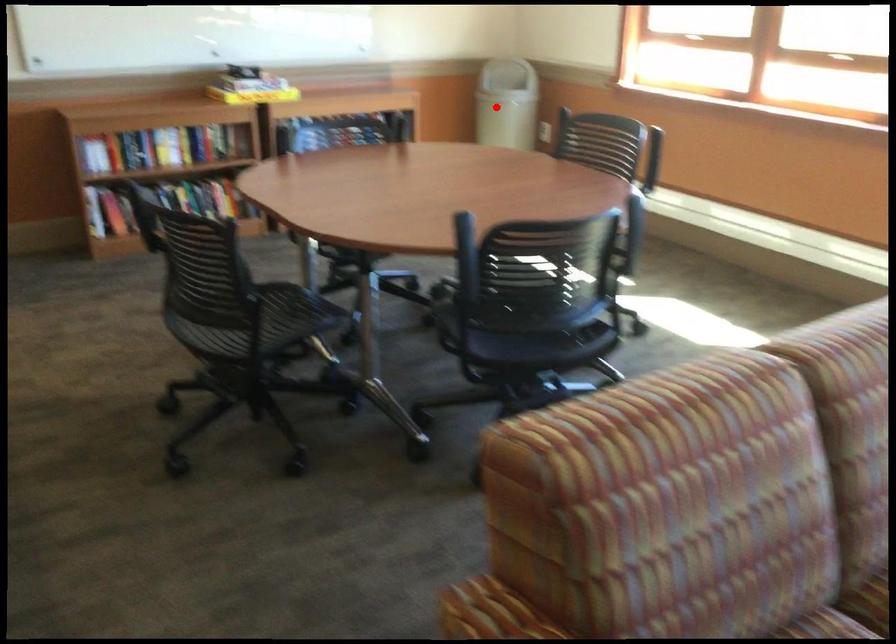
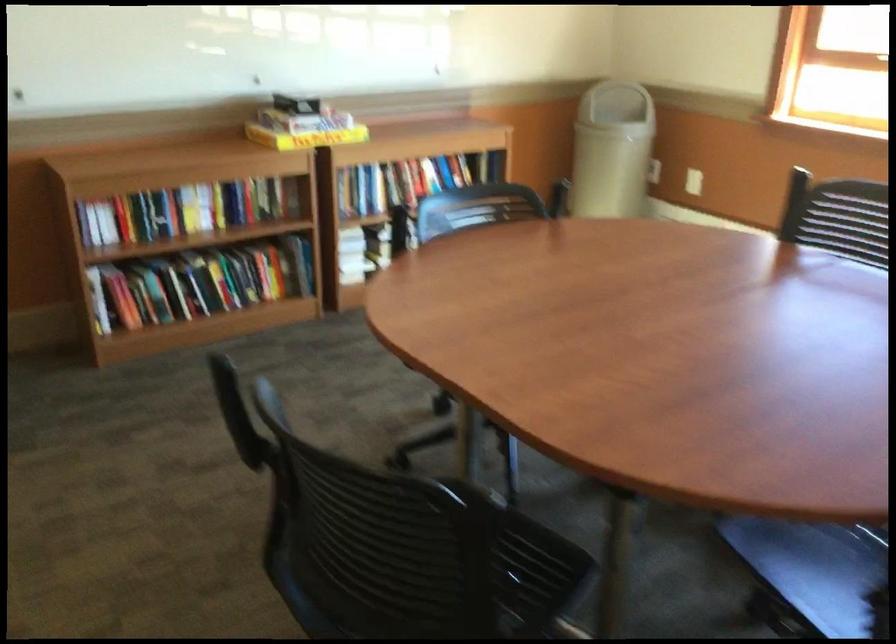
Question: I am providing you with two images of the same scene from different viewpoints. Given a red point in image1, look at the same physical point in image2. Is it:

Choices:
 (A) Closer to the viewpoint
 (B) Farther from the viewpoint

Answer: (A)